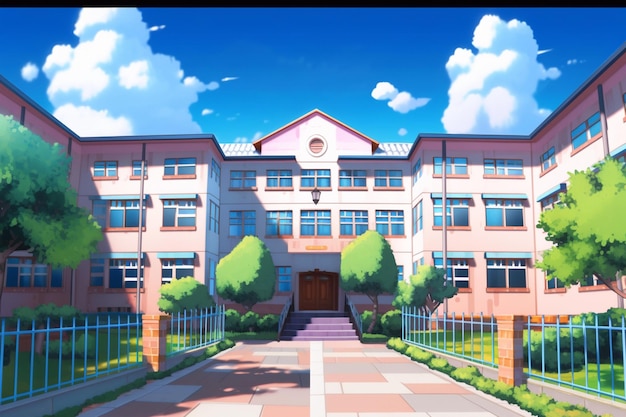
At what (x,y) coordinates should I click in order to perform the action: click on door. Please return your answer as a coordinate pair (x, y). The image size is (626, 417). Looking at the image, I should click on (312, 285).